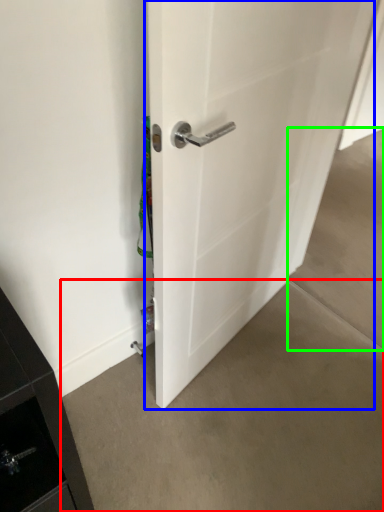
Question: Which object is positioned farthest from concrete (highlighted by a red box)? Select from door (highlighted by a blue box) and concrete (highlighted by a green box).

Choices:
 (A) door
 (B) concrete

Answer: (B)